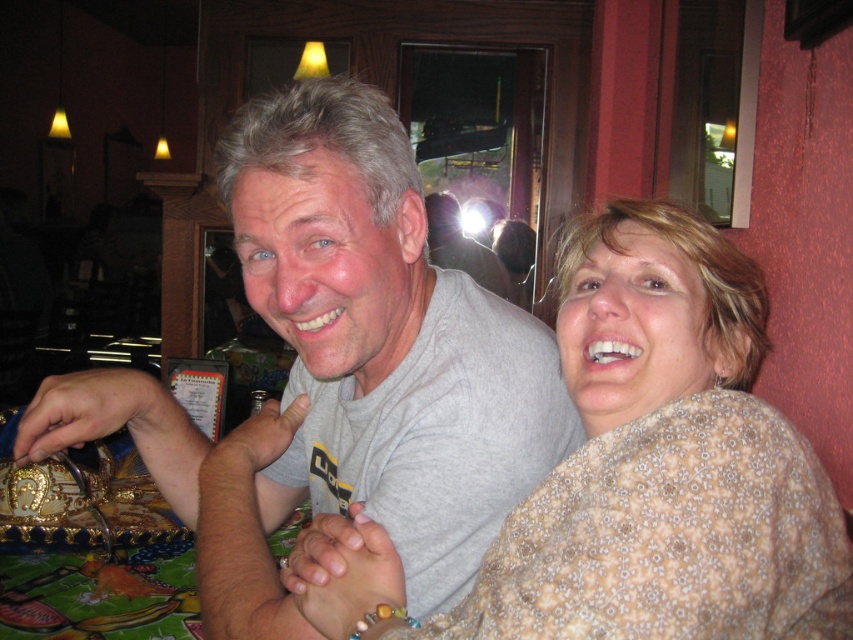
At what (x,y) coordinates should I click in order to perform the action: click on gray cotton t-shirt at center. Please return your answer as a coordinate pair (x, y). Looking at the image, I should click on click(340, 371).

Which is behind, point (392, 321) or point (358, 572)?

Positioned behind is point (392, 321).

Where is `gray cotton t-shirt at center`? gray cotton t-shirt at center is located at coordinates (340, 371).